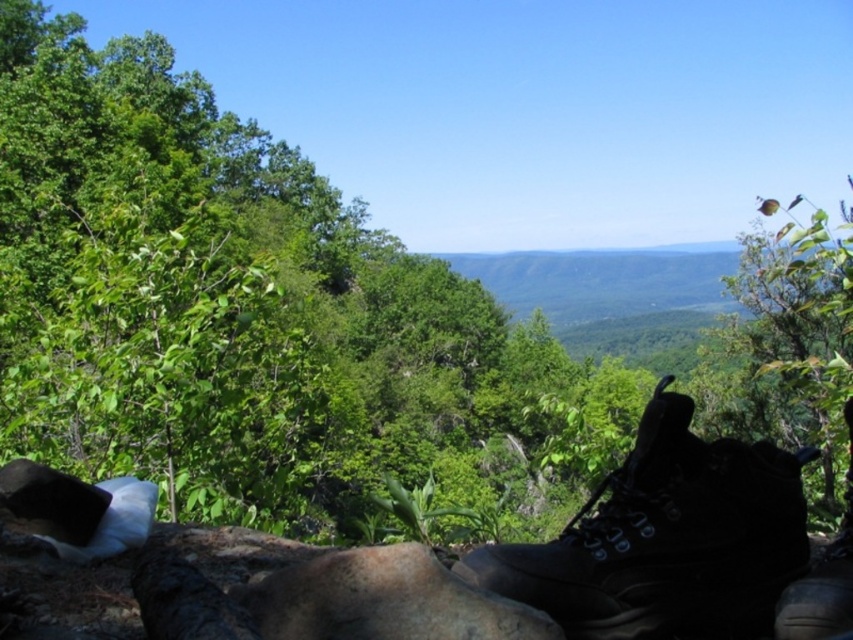
Find the location of a particular element. This screenshot has width=853, height=640. matte black boot at lower right is located at coordinates (666, 540).

What do you see at coordinates (666, 540) in the screenshot? I see `matte black boot at lower right` at bounding box center [666, 540].

This screenshot has width=853, height=640. What do you see at coordinates (666, 540) in the screenshot?
I see `matte black boot at lower right` at bounding box center [666, 540].

Image resolution: width=853 pixels, height=640 pixels. What are the coordinates of `matte black boot at lower right` in the screenshot? It's located at (666, 540).